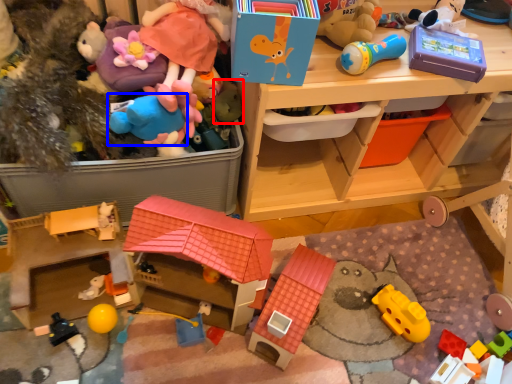
Question: Among these objects, which one is farthest to the camera, toy (highlighted by a red box) or toy (highlighted by a blue box)?

Choices:
 (A) toy
 (B) toy

Answer: (A)